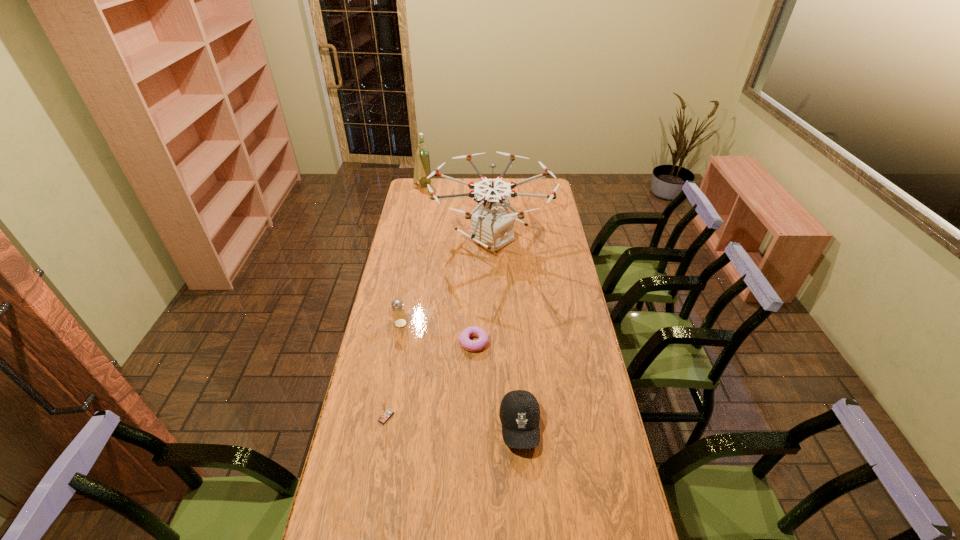
Where is `object that is at the far left corner`? The height and width of the screenshot is (540, 960). object that is at the far left corner is located at coordinates (422, 169).

Locate an element on the screen. The width and height of the screenshot is (960, 540). free space at the far edge is located at coordinates (446, 194).

Identify the location of vacant space at the left edge of the desktop. (390, 278).

I want to click on free location at the right edge, so click(x=628, y=501).

At what (x,y) coordinates should I click in order to perform the action: click on free space at the far right corner. Please return your answer as a coordinate pair (x, y). Looking at the image, I should click on (536, 189).

I want to click on vacant area that lies between the fourth nearest object and the matchbox, so click(x=394, y=370).

The image size is (960, 540). I want to click on unoccupied area between the fourth nearest object and the fourth farthest object, so click(438, 333).

This screenshot has width=960, height=540. What are the coordinates of `free space that is in between the shortest object and the drone` in the screenshot? It's located at (483, 291).

I want to click on vacant point located between the drone and the baseball cap, so click(x=506, y=333).

Where is `empty space that is in between the baseball cap and the saltshaker`? The height and width of the screenshot is (540, 960). empty space that is in between the baseball cap and the saltshaker is located at coordinates (460, 375).